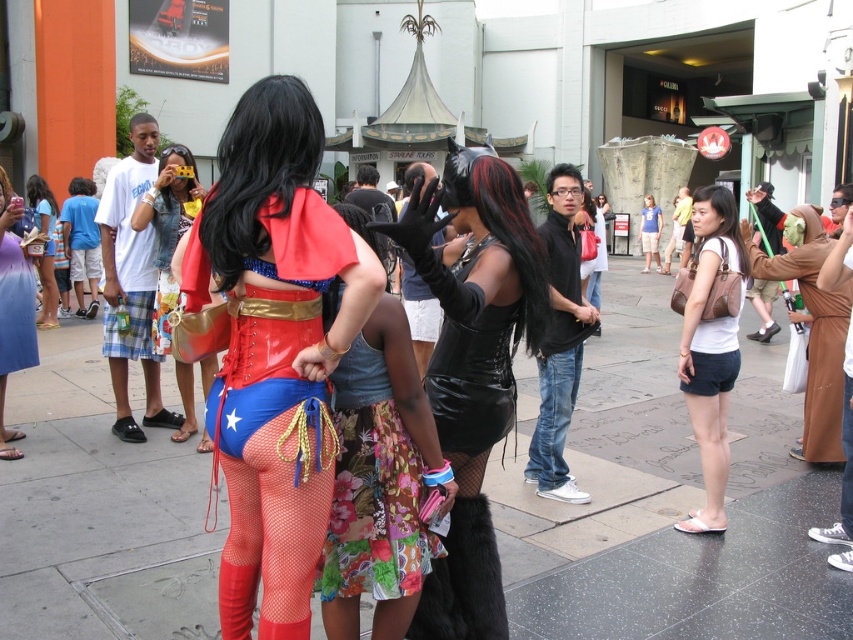
Question: Can you confirm if latex costume at center is wider than matte brown purse at left?

Choices:
 (A) no
 (B) yes

Answer: (A)

Question: Which is nearer to the white matte shorts at right?

Choices:
 (A) matte black purse at center
 (B) shiny concrete sidewalk at center
 (C) brown leather dress at lower right
 (D) floral denim skirt at center

Answer: (C)

Question: Does white matte shorts at right have a greater width compared to brown leather dress at lower right?

Choices:
 (A) no
 (B) yes

Answer: (A)

Question: Based on their relative distances, which object is farther from the matte black purse at center?

Choices:
 (A) brown leather dress at lower right
 (B) white matte shorts at right
 (C) shiny black corset at center
 (D) matte purple skirt at lower left

Answer: (A)

Question: Which point is farther to the camera?

Choices:
 (A) latex costume at center
 (B) shiny concrete sidewalk at center
 (C) shiny black corset at center

Answer: (B)

Question: Is latex costume at center wider than matte purple skirt at lower left?

Choices:
 (A) yes
 (B) no

Answer: (B)